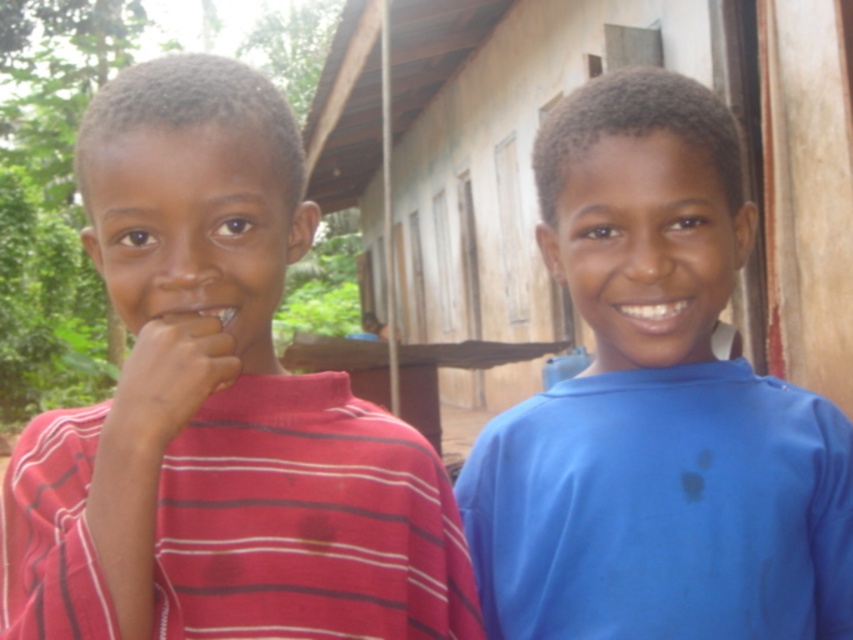
Question: Which object is closer to the camera taking this photo?

Choices:
 (A) striped cotton shirt at left
 (B) matte skin hand at left

Answer: (A)

Question: Which of the following is the closest to the observer?

Choices:
 (A) (199, 115)
 (B) (170, 404)

Answer: (B)

Question: Considering the relative positions of blue matte shirt at right and matte skin hand at left in the image provided, where is blue matte shirt at right located with respect to matte skin hand at left?

Choices:
 (A) above
 (B) below

Answer: (A)

Question: Estimate the real-world distances between objects in this image. Which object is closer to the matte skin hand at left?

Choices:
 (A) blue matte shirt at right
 (B) striped cotton shirt at left

Answer: (B)

Question: Is blue matte shirt at right above matte skin hand at left?

Choices:
 (A) yes
 (B) no

Answer: (A)

Question: Considering the relative positions of blue matte shirt at right and matte skin hand at left in the image provided, where is blue matte shirt at right located with respect to matte skin hand at left?

Choices:
 (A) above
 (B) below

Answer: (A)